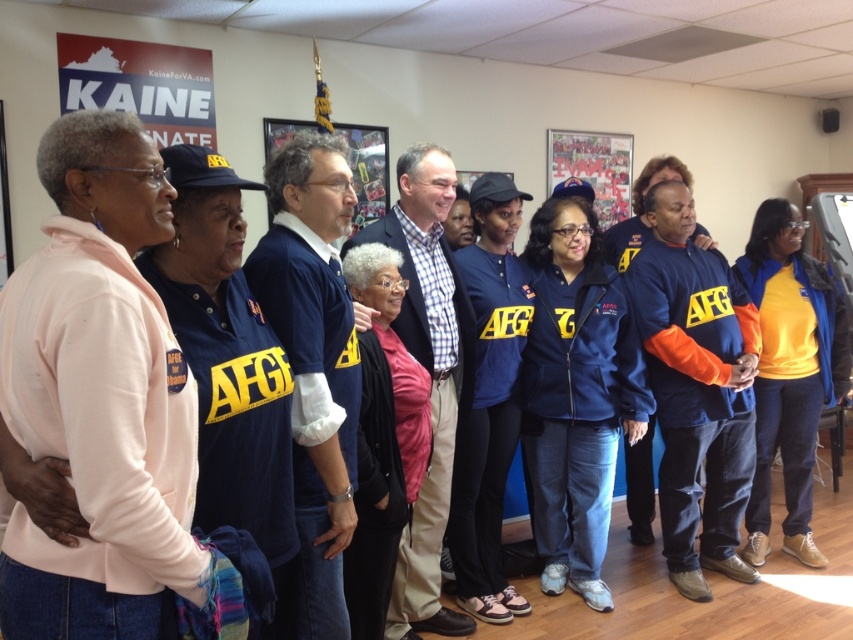
Does pink fleece jacket at left have a lesser width compared to orange fleece jacket at center?

Indeed, pink fleece jacket at left has a lesser width compared to orange fleece jacket at center.

Between pink fleece jacket at left and orange fleece jacket at center, which one has more height?

With more height is orange fleece jacket at center.

Is point (99, 486) farther from viewer compared to point (819, 372)?

No, it is in front of (819, 372).

You are a GUI agent. You are given a task and a screenshot of the screen. Output one action in this format:
    pyautogui.click(x=<x>, y=<y>)
    Task: Click on the pink fleece jacket at left
    The height and width of the screenshot is (640, 853).
    Given the screenshot: What is the action you would take?
    pyautogui.click(x=100, y=396)